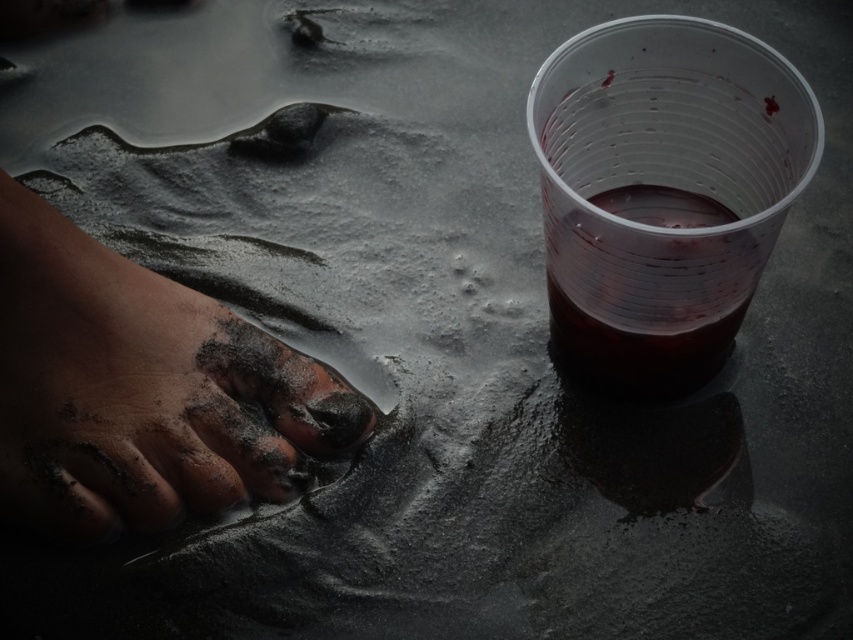
Question: Based on their relative distances, which object is farther from the dusty skin foot at lower left?

Choices:
 (A) transparent plastic cup at upper right
 (B) translucent plastic cup at upper right

Answer: (A)

Question: Estimate the real-world distances between objects in this image. Which object is closer to the dusty skin foot at lower left?

Choices:
 (A) transparent plastic cup at upper right
 (B) translucent plastic cup at upper right

Answer: (B)

Question: Is transparent plastic cup at upper right below dusty skin foot at lower left?

Choices:
 (A) no
 (B) yes

Answer: (A)

Question: Does transparent plastic cup at upper right come in front of dusty skin foot at lower left?

Choices:
 (A) yes
 (B) no

Answer: (A)

Question: Does transparent plastic cup at upper right appear over translucent plastic cup at upper right?

Choices:
 (A) no
 (B) yes

Answer: (B)

Question: Among these objects, which one is nearest to the camera?

Choices:
 (A) transparent plastic cup at upper right
 (B) translucent plastic cup at upper right
 (C) dusty skin foot at lower left

Answer: (A)